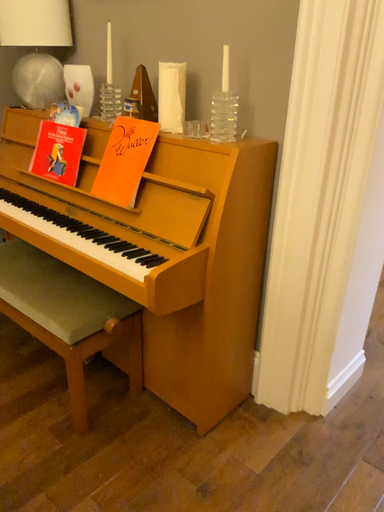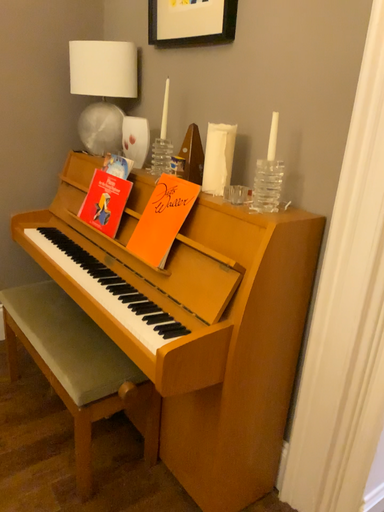
Question: How did the camera likely rotate when shooting the video?

Choices:
 (A) rotated left
 (B) rotated right

Answer: (A)